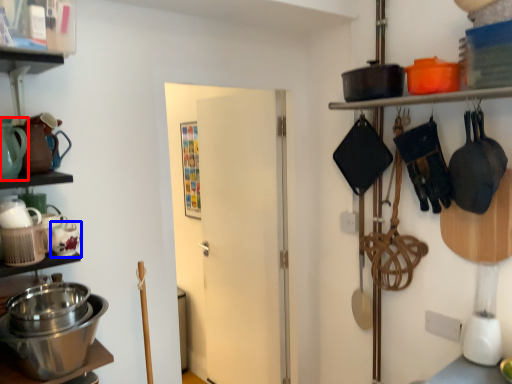
Question: Among these objects, which one is farthest to the camera, tea pot (highlighted by a red box) or tea pot (highlighted by a blue box)?

Choices:
 (A) tea pot
 (B) tea pot

Answer: (B)